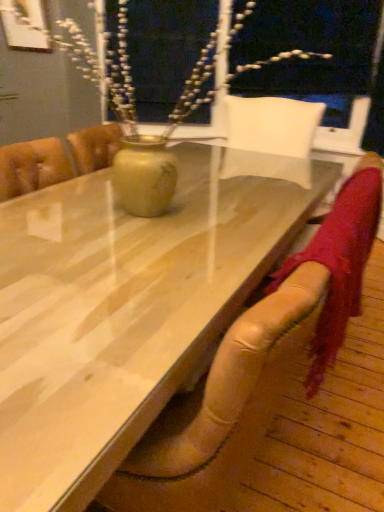
Question: Does leather armchair at lower right lie in front of wooden table at center?

Choices:
 (A) no
 (B) yes

Answer: (A)

Question: Would you consider leather armchair at lower right to be distant from wooden table at center?

Choices:
 (A) no
 (B) yes

Answer: (A)

Question: Can you confirm if leather armchair at lower right is positioned to the right of wooden table at center?

Choices:
 (A) yes
 (B) no

Answer: (A)

Question: Is leather armchair at lower right not inside wooden table at center?

Choices:
 (A) no
 (B) yes

Answer: (A)

Question: Is wooden table at center completely or partially inside leather armchair at lower right?

Choices:
 (A) no
 (B) yes

Answer: (A)

Question: From a real-world perspective, is leather armchair at lower right positioned over wooden table at center based on gravity?

Choices:
 (A) yes
 (B) no

Answer: (A)

Question: Is wooden table at center further to camera compared to leather armchair at lower right?

Choices:
 (A) yes
 (B) no

Answer: (B)

Question: Can you confirm if wooden table at center is taller than leather armchair at lower right?

Choices:
 (A) no
 (B) yes

Answer: (A)

Question: Does wooden table at center turn towards leather armchair at lower right?

Choices:
 (A) yes
 (B) no

Answer: (B)

Question: From a real-world perspective, is wooden table at center physically above leather armchair at lower right?

Choices:
 (A) yes
 (B) no

Answer: (B)

Question: Considering the relative sizes of wooden table at center and leather armchair at lower right in the image provided, is wooden table at center bigger than leather armchair at lower right?

Choices:
 (A) no
 (B) yes

Answer: (B)

Question: From a real-world perspective, is wooden table at center below leather armchair at lower right?

Choices:
 (A) yes
 (B) no

Answer: (A)

Question: Is leather armchair at lower right in front of or behind wooden table at center in the image?

Choices:
 (A) front
 (B) behind

Answer: (B)